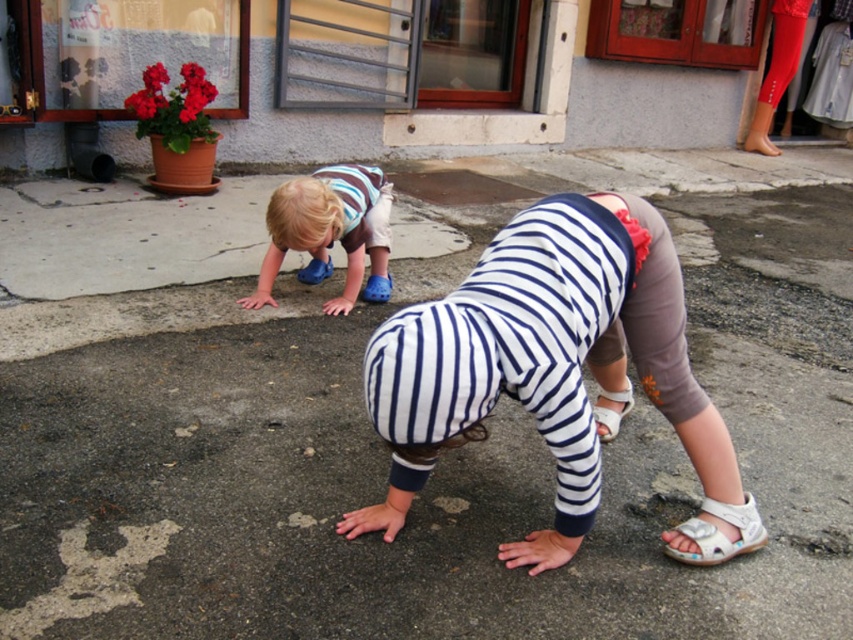
Question: Is gray asphalt at center behind white leather sandal at lower right?

Choices:
 (A) no
 (B) yes

Answer: (A)

Question: Can you confirm if white striped shirt at center is positioned above white leather sandal at lower center?

Choices:
 (A) yes
 (B) no

Answer: (A)

Question: Based on their relative distances, which object is nearer to the white leather sandal at lower center?

Choices:
 (A) white leather sandal at lower right
 (B) matte blue shoes at lower left

Answer: (A)

Question: Which of the following is the closest to the observer?

Choices:
 (A) white leather sandal at lower right
 (B) white striped shirt at center

Answer: (B)

Question: Which of the following is the closest to the observer?

Choices:
 (A) matte red leggings at upper right
 (B) white leather sandal at lower center
 (C) white striped shirt at center

Answer: (C)

Question: In this image, where is white striped shirt at center located relative to matte red leggings at upper right?

Choices:
 (A) left
 (B) right

Answer: (A)